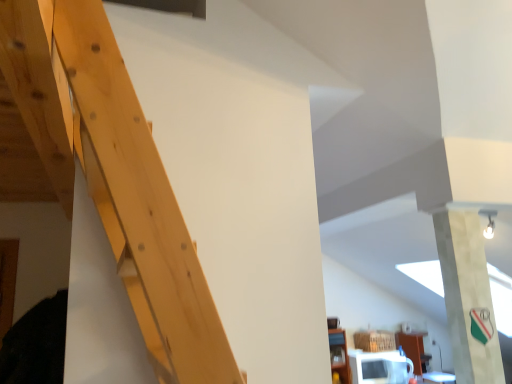
Question: Is white glossy microwave at lower right bigger or smaller than white fabric banner at upper right?

Choices:
 (A) small
 (B) big

Answer: (B)

Question: Is point click(382, 380) positioned closer to the camera than point click(455, 354)?

Choices:
 (A) farther
 (B) closer

Answer: (A)

Question: Is white glossy microwave at lower right situated inside white fabric banner at upper right or outside?

Choices:
 (A) outside
 (B) inside

Answer: (A)

Question: Is point (464, 352) positioned closer to the camera than point (406, 380)?

Choices:
 (A) closer
 (B) farther

Answer: (A)

Question: Would you say white fabric banner at upper right is inside or outside white glossy microwave at lower right?

Choices:
 (A) outside
 (B) inside

Answer: (A)

Question: In terms of height, does white fabric banner at upper right look taller or shorter compared to white glossy microwave at lower right?

Choices:
 (A) short
 (B) tall

Answer: (B)

Question: Relative to white glossy microwave at lower right, is white fabric banner at upper right in front or behind?

Choices:
 (A) behind
 (B) front

Answer: (B)